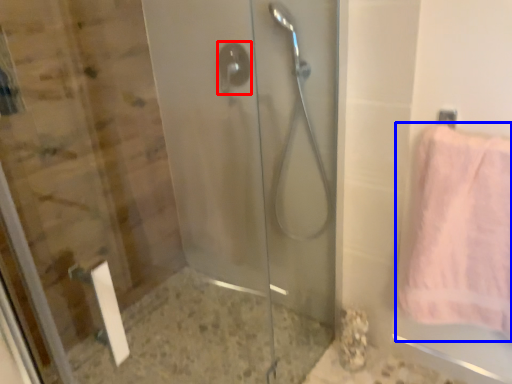
Question: Which object appears farthest to the camera in this image, shower (highlighted by a red box) or towel (highlighted by a blue box)?

Choices:
 (A) shower
 (B) towel

Answer: (A)